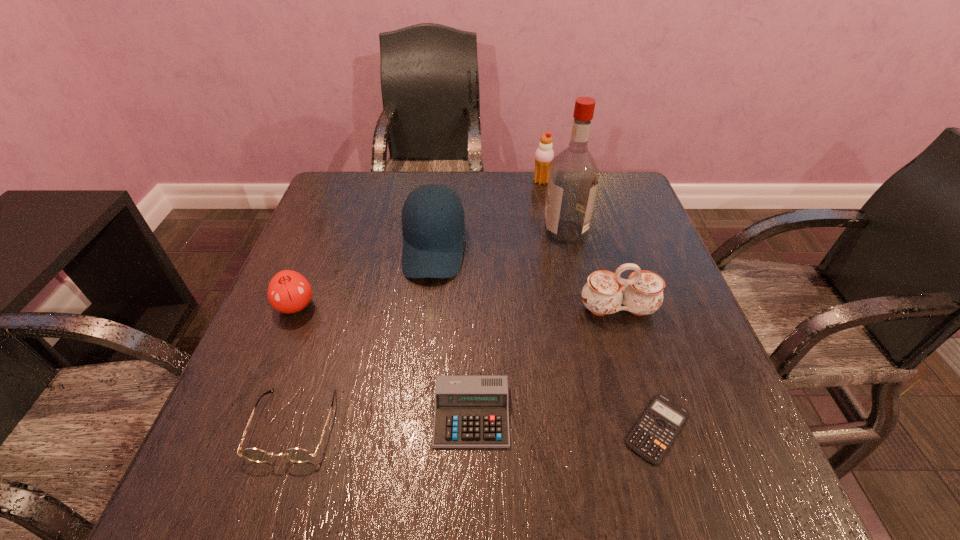
The image size is (960, 540). I want to click on the tallest object, so click(x=573, y=179).

You are a GUI agent. You are given a task and a screenshot of the screen. Output one action in this format:
    pyautogui.click(x=<x>, y=<y>)
    Task: Click on the icecream
    This screenshot has height=540, width=960.
    Given the screenshot: What is the action you would take?
    pyautogui.click(x=544, y=154)

The height and width of the screenshot is (540, 960). I want to click on baseball cap, so click(x=433, y=224).

The image size is (960, 540). In order to click on chinaware in this screenshot , I will do `click(641, 294)`.

Find the location of a particular element. The height and width of the screenshot is (540, 960). apple is located at coordinates (288, 292).

Locate an element on the screen. The width and height of the screenshot is (960, 540). spectacles is located at coordinates (298, 455).

Locate an element on the screen. the left calculator is located at coordinates (471, 411).

Locate an element on the screen. This screenshot has width=960, height=540. the second shortest object is located at coordinates (471, 411).

I want to click on the right calculator, so click(x=652, y=436).

In order to click on the shortest object in this screenshot , I will do `click(652, 436)`.